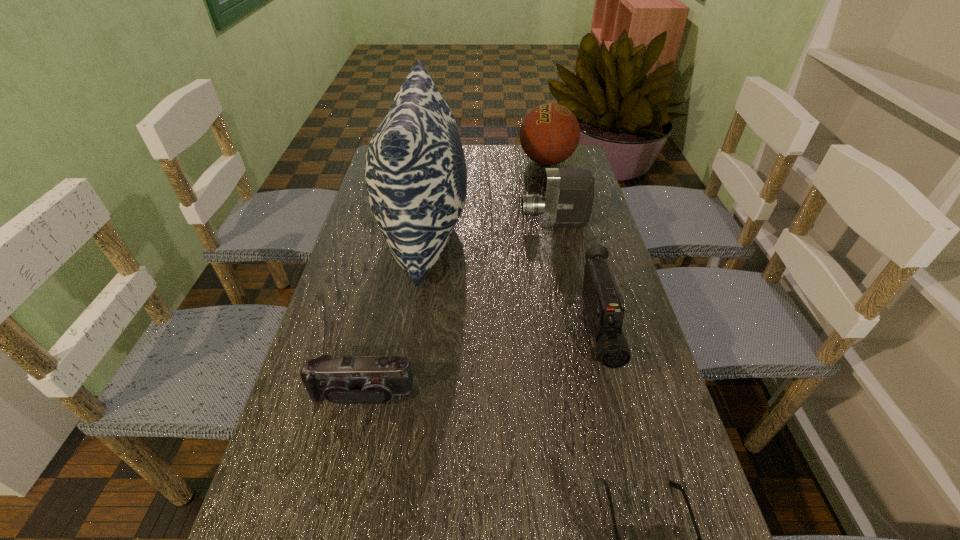
The image size is (960, 540). I want to click on free space between the farthest camcorder and the leftmost camcorder, so click(x=458, y=308).

Image resolution: width=960 pixels, height=540 pixels. What are the coordinates of `blank region between the leftmost camcorder and the farthest camcorder` in the screenshot? It's located at (458, 308).

This screenshot has width=960, height=540. Identify the location of free spot between the tallest object and the farthest camcorder. (490, 230).

You are a GUI agent. You are given a task and a screenshot of the screen. Output one action in this format:
    pyautogui.click(x=<x>, y=<y>)
    Task: Click on the vacant area that lies between the leftmost camcorder and the farthest object
    The height and width of the screenshot is (540, 960).
    Given the screenshot: What is the action you would take?
    pyautogui.click(x=454, y=278)

At what (x,y) coordinates should I click in order to perform the action: click on vacant region between the cushion and the fifth tallest object. Please return your answer as a coordinate pair (x, y). The image size is (960, 540). Looking at the image, I should click on (394, 314).

Where is `vacant area that lies between the farthest object and the cushion`? vacant area that lies between the farthest object and the cushion is located at coordinates (486, 199).

What are the coordinates of `object that is the fifth closest one to the farthest camcorder` in the screenshot? It's located at (673, 484).

Identify the location of object that is the fifth nearest to the leftmost camcorder. (550, 133).

Identify which camcorder is the closest to the farthest object. Please provide its 2D coordinates. Your answer should be formatted as a tuple, i.e. [(x, y)], where the tuple contains the x and y coordinates of a point satisfying the conditions above.

[(566, 200)]

You are a GUI agent. You are given a task and a screenshot of the screen. Output one action in this format:
    pyautogui.click(x=<x>, y=<y>)
    Task: Click on the camcorder that is the second nearest to the nearest object
    Image resolution: width=960 pixels, height=540 pixels.
    Given the screenshot: What is the action you would take?
    pyautogui.click(x=367, y=379)